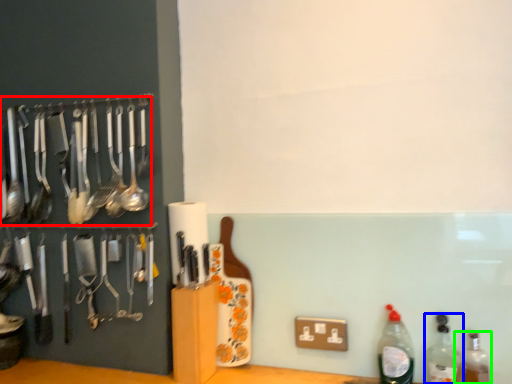
Question: Which is nearer to the spoon (highlighted by a red box)? bottle (highlighted by a blue box) or bottle (highlighted by a green box).

Choices:
 (A) bottle
 (B) bottle

Answer: (A)